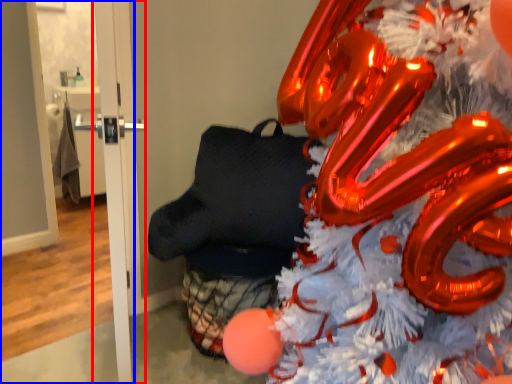
Question: Among these objects, which one is farthest to the camera, door (highlighted by a red box) or door (highlighted by a blue box)?

Choices:
 (A) door
 (B) door

Answer: (B)